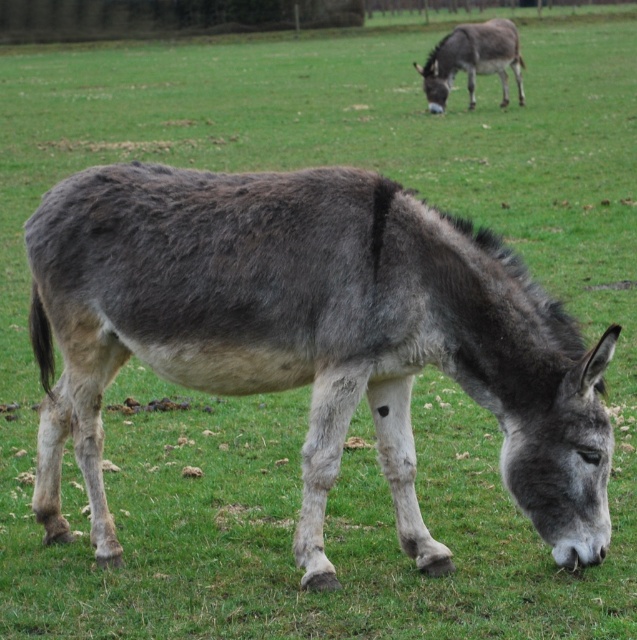
Who is positioned more to the right, gray fuzzy donkey at center or gray matte mule at upper right?

gray matte mule at upper right is more to the right.

Which is in front, point (259, 324) or point (455, 56)?

Point (259, 324) is in front.

This screenshot has height=640, width=637. What are the coordinates of `gray fuzzy donkey at center` in the screenshot? It's located at (311, 337).